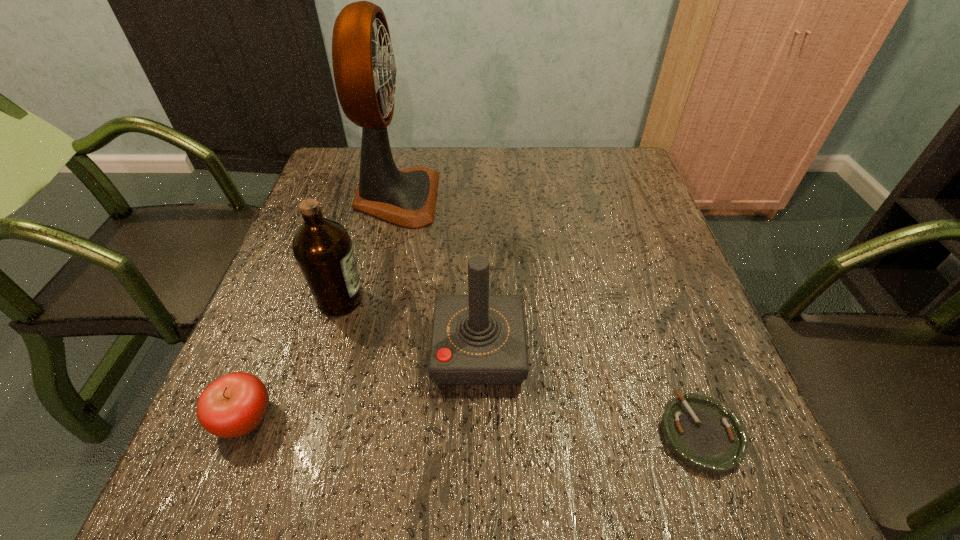
Find the location of `vacant space that is in between the second shortest object and the second object from right to left`. vacant space that is in between the second shortest object and the second object from right to left is located at coordinates (362, 383).

Find the location of a particular element. The height and width of the screenshot is (540, 960). the second closest object to the tallest object is located at coordinates (477, 339).

Where is `the third closest object to the farthest object`? The width and height of the screenshot is (960, 540). the third closest object to the farthest object is located at coordinates click(x=235, y=404).

You are a GUI agent. You are given a task and a screenshot of the screen. Output one action in this format:
    pyautogui.click(x=<x>, y=<y>)
    Task: Click on the vacant space that satisfies the following two spatial constraints: 1. on the label of the ashtray; 2. on the left side of the olive oil
    
    Given the screenshot: What is the action you would take?
    pyautogui.click(x=301, y=433)

Find the location of a particular element. free spot that satisfies the following two spatial constraints: 1. on the back side of the ashtray; 2. on the rectangular base of the second object from right to left is located at coordinates click(x=670, y=349).

You are a GUI agent. You are given a task and a screenshot of the screen. Output one action in this format:
    pyautogui.click(x=<x>, y=<y>)
    Task: Click on the vacant space that satisfies the following two spatial constraints: 1. on the front-facing side of the tallest object; 2. on the left side of the shortest object
    This screenshot has height=540, width=960.
    Given the screenshot: What is the action you would take?
    pyautogui.click(x=344, y=433)

Where is `vacant point that satisfies the following two spatial constraints: 1. on the front-facing side of the farthest object; 2. on the front side of the fourth tallest object`? vacant point that satisfies the following two spatial constraints: 1. on the front-facing side of the farthest object; 2. on the front side of the fourth tallest object is located at coordinates [x=348, y=418].

Identify the location of vacant space that satisfies the following two spatial constraints: 1. on the rectangular base of the second object from right to left; 2. on the right side of the ashtray. (479, 433).

Where is `free location that satisfies the following two spatial constraints: 1. on the rectangular base of the second object from right to left; 2. on the back side of the rightmost object`? free location that satisfies the following two spatial constraints: 1. on the rectangular base of the second object from right to left; 2. on the back side of the rightmost object is located at coordinates (479, 433).

At what (x,y) coordinates should I click in order to perform the action: click on vacant space that satisfies the following two spatial constraints: 1. on the front-facing side of the tallest object; 2. on the left side of the shortest object. Please return your answer as a coordinate pair (x, y). Looking at the image, I should click on (344, 433).